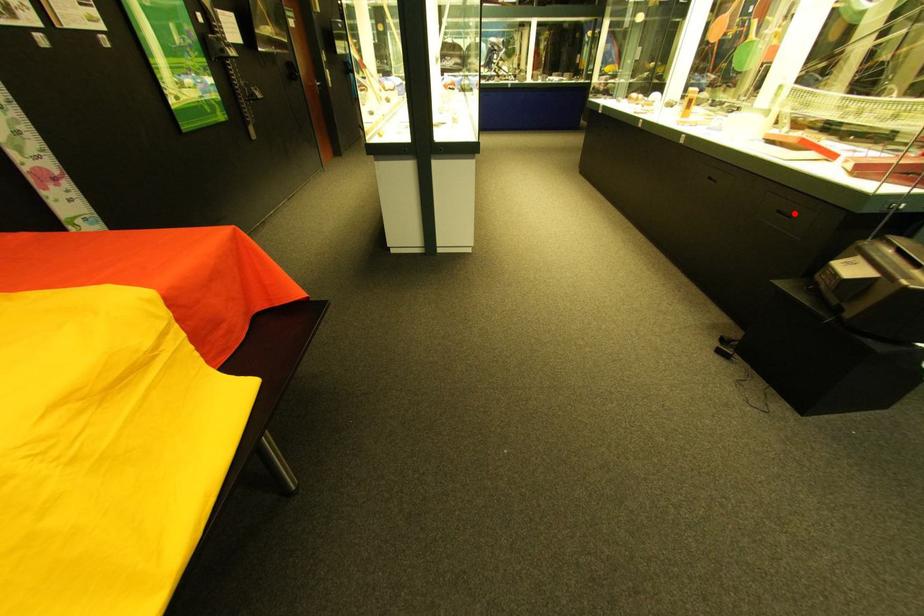
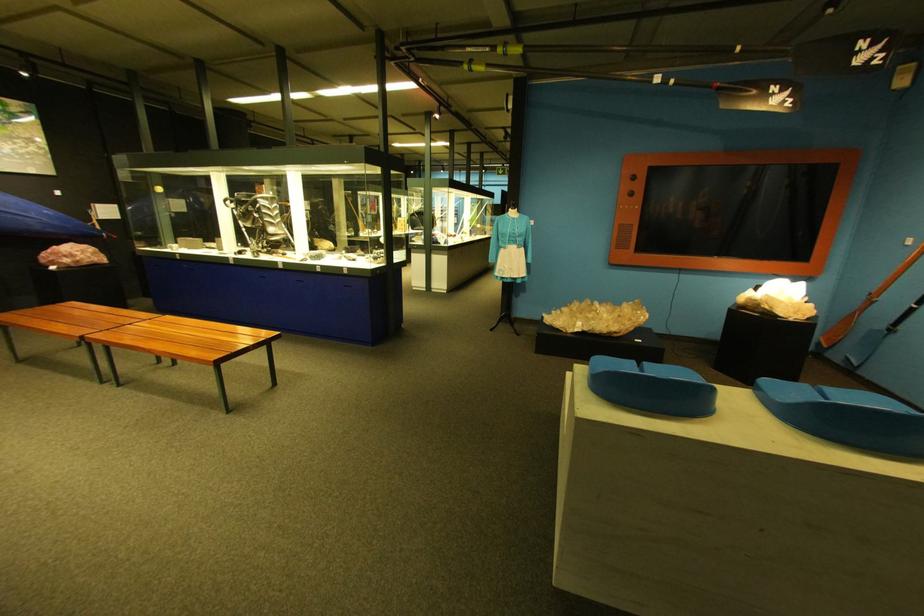
Question: I am providing you with two images of the same scene from different viewpoints. A red point is marked on the first image. At the location where the point appears in image 1, is it still visible in image 2?

Choices:
 (A) Yes
 (B) No

Answer: (B)